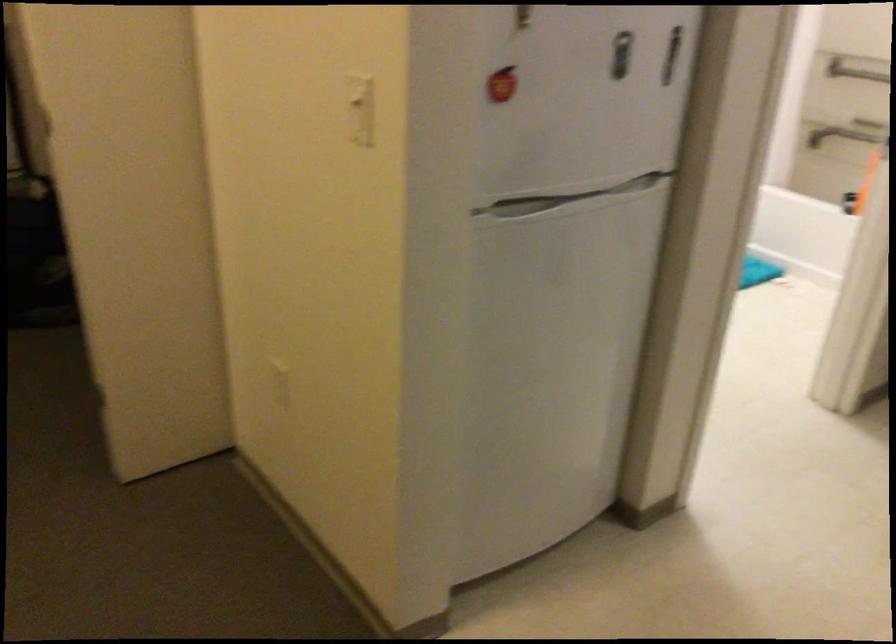
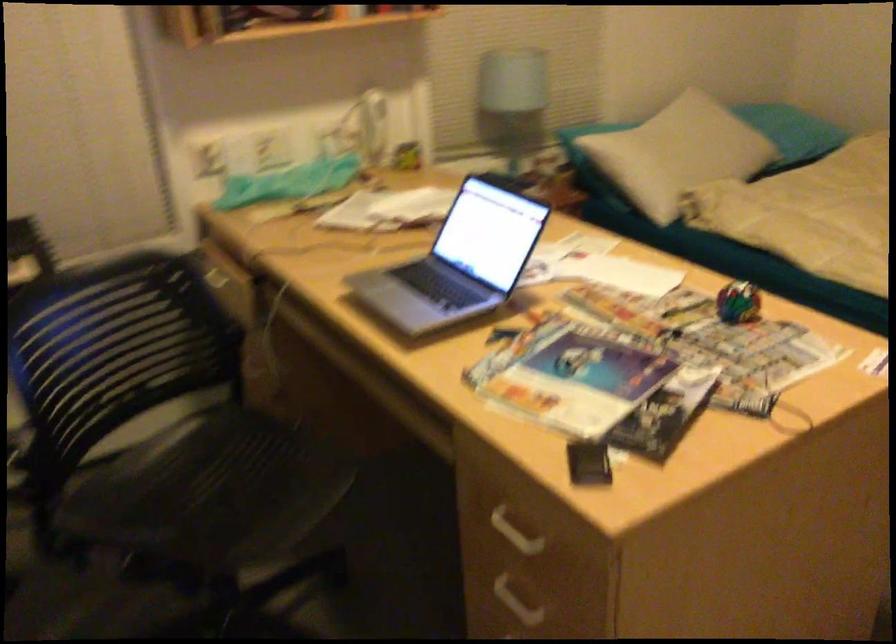
Based on the continuous images, in which direction is the camera rotating?

The camera rotated toward left-down.